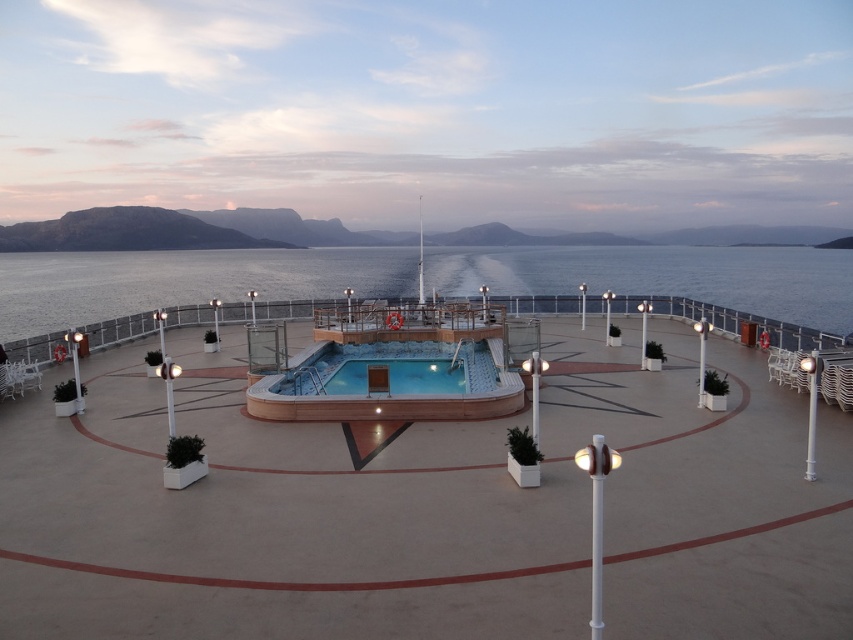
In the scene shown: Does smooth concrete deck at center have a lesser width compared to wooden swimming pool at center?

In fact, smooth concrete deck at center might be wider than wooden swimming pool at center.

Can you confirm if smooth concrete deck at center is smaller than wooden swimming pool at center?

Actually, smooth concrete deck at center might be larger than wooden swimming pool at center.

Which is in front, point (347, 460) or point (254, 410)?

Point (347, 460)

The height and width of the screenshot is (640, 853). I want to click on smooth concrete deck at center, so click(430, 509).

Who is lower down, clear blue water at center or wooden swimming pool at center?

wooden swimming pool at center

Between point (358, 248) and point (317, 342), which one is positioned in front?

Point (317, 342) is in front.

Image resolution: width=853 pixels, height=640 pixels. Describe the element at coordinates (183, 280) in the screenshot. I see `clear blue water at center` at that location.

The height and width of the screenshot is (640, 853). I want to click on clear blue water at center, so click(x=183, y=280).

Is smooth concrete deck at center to the left of clear blue water at center from the viewer's perspective?

No, smooth concrete deck at center is not to the left of clear blue water at center.

Is point (149, 460) less distant than point (225, 259)?

Yes, point (149, 460) is closer to viewer.

What do you see at coordinates (430, 509) in the screenshot?
I see `smooth concrete deck at center` at bounding box center [430, 509].

Where is `smooth concrete deck at center`? This screenshot has height=640, width=853. smooth concrete deck at center is located at coordinates (430, 509).